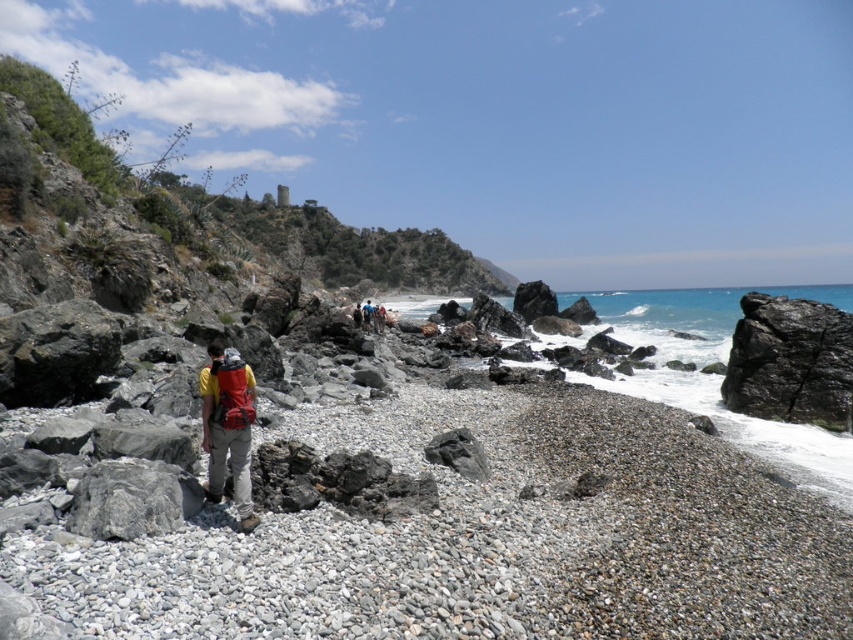
You are a hiker planning to place your matte red backpack at center on top of the black rough rock at right. Based on the scene, will the backpack fit on the rock without falling off?

The black rough rock at right has a larger size compared to matte red backpack at center, so the backpack should fit securely on the rock without falling off.

You are standing at the rocky beach and want to move from point A to point B. Point A is located at coordinates point (780, 416) and point B is at point (173, 483). Given the terrain described, which direction should you move to reach point B from point A?

To move from point (780, 416) to point (173, 483), you should move downward and to the right since point (780, 416) is higher up and to the left compared to point (173, 483).

You are a hiker planning to walk from the black rough rock at right to the matte red backpack at center. Which object will you encounter first?

You will encounter the black rough rock at right first because it is closer to you than the matte red backpack at center.